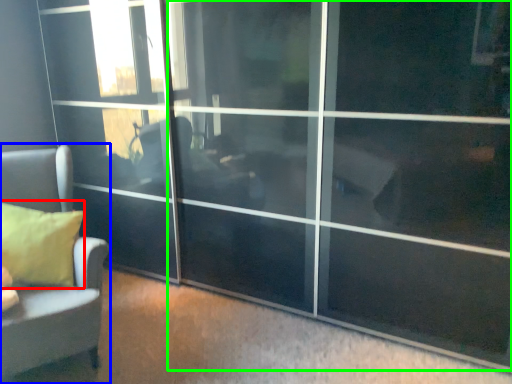
Question: Based on their relative distances, which object is farther from pillow (highlighted by a red box)? Choose from furniture (highlighted by a blue box) and screen door (highlighted by a green box).

Choices:
 (A) furniture
 (B) screen door

Answer: (B)